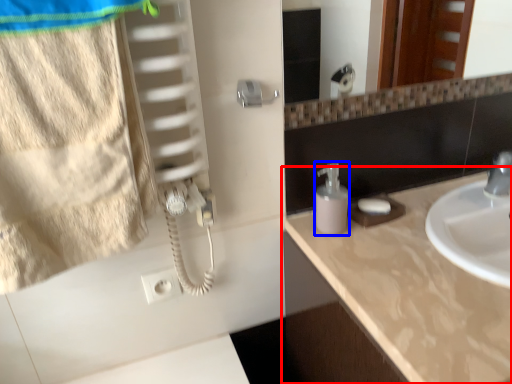
Question: Which point is closer to the camera, countertop (highlighted by a red box) or soap dispenser (highlighted by a blue box)?

Choices:
 (A) countertop
 (B) soap dispenser

Answer: (A)